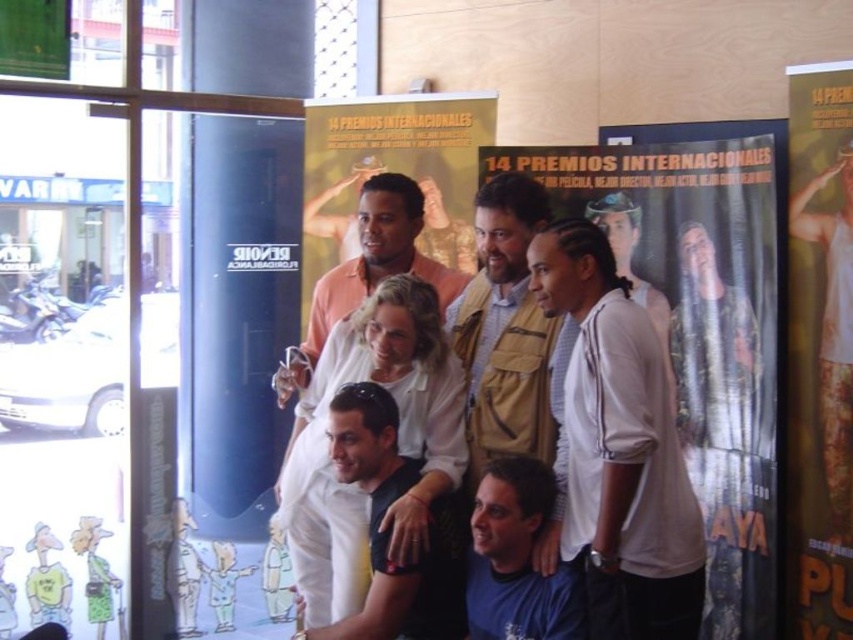
You are at a press event and notice two people wearing the beige textured vest at center and the matte peach shirt at center. Which one is positioned to the right of the other?

The beige textured vest at center is positioned to the right of the matte peach shirt at center.

Based on the scene description, where is the white cotton shirt at upper right located in terms of coordinates?

The white cotton shirt at upper right is located at coordinates point (619, 448).

You are a photographer at this event and need to adjust the lighting so that both the white matte shirt at center and the blue fabric shirt at center are equally illuminated. Given their current distance apart, can you estimate if the lighting setup will require adjustment to ensure even illumination?

The white matte shirt at center and blue fabric shirt at center are 11.66 inches apart. To ensure even illumination, the lighting setup may require adjustment as the distance between them might cause uneven lighting if not properly calibrated.